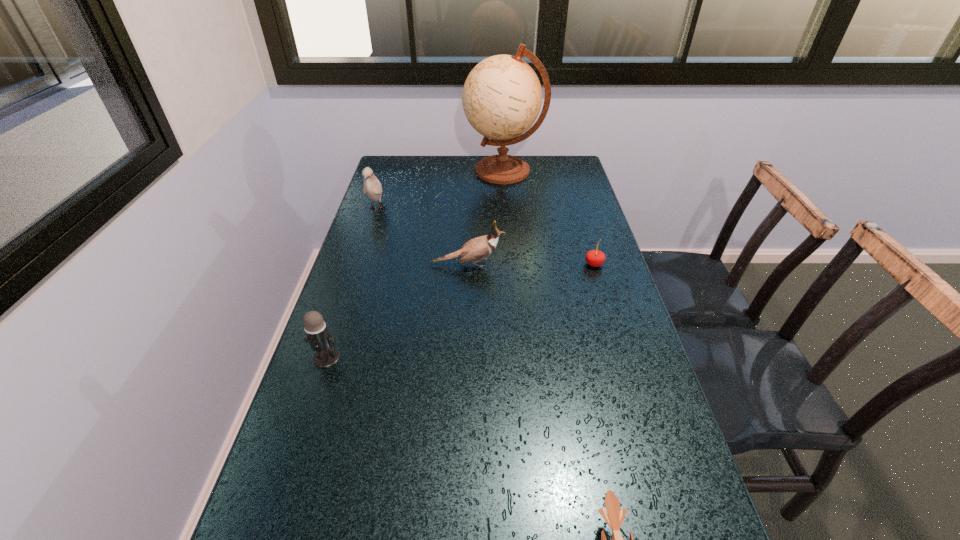
Identify the location of vacant space located at the beak of the fifth nearest object. The height and width of the screenshot is (540, 960). (363, 251).

The image size is (960, 540). I want to click on free region located at the face of the second bird from left to right, so click(583, 265).

At what (x,y) coordinates should I click in order to perform the action: click on free space located 0.210m on the right of the fifth farthest object. Please return your answer as a coordinate pair (x, y). The height and width of the screenshot is (540, 960). Looking at the image, I should click on (431, 357).

I want to click on vacant space situated 0.120m on the back of the cherry, so click(x=585, y=235).

Identify the location of object positioned at the far edge. (502, 96).

At what (x,y) coordinates should I click in order to perform the action: click on bird that is at the left edge. Please return your answer as a coordinate pair (x, y). This screenshot has width=960, height=540. Looking at the image, I should click on (372, 187).

Where is `microphone present at the left edge`? microphone present at the left edge is located at coordinates (320, 340).

The height and width of the screenshot is (540, 960). I want to click on globe present at the right edge, so click(502, 96).

The height and width of the screenshot is (540, 960). I want to click on cherry located in the right edge section of the desktop, so click(x=595, y=258).

Where is `object that is at the far right corner`? object that is at the far right corner is located at coordinates (502, 96).